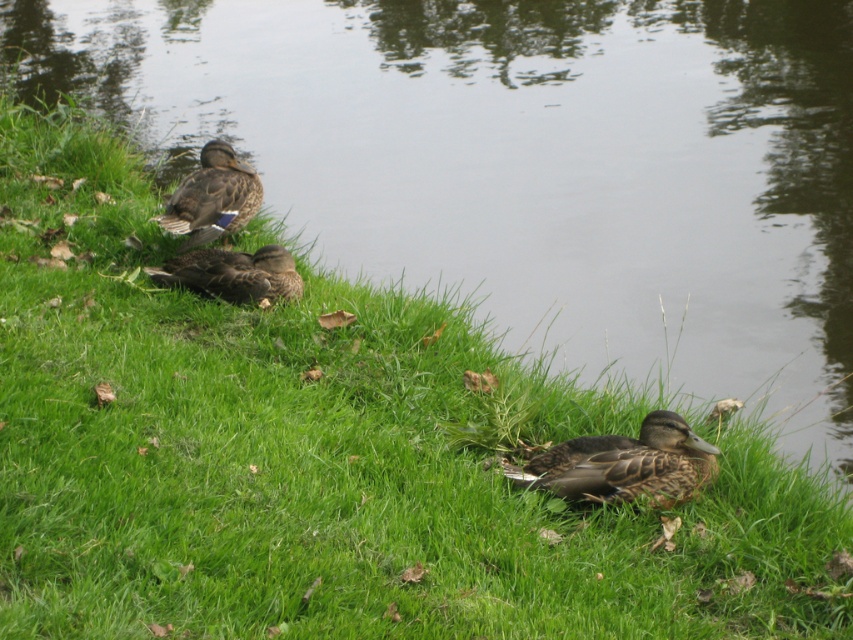
Question: Which object is closer to the camera taking this photo?

Choices:
 (A) brown feathered duck at upper left
 (B) brown speckled duck at center

Answer: (B)

Question: Can you confirm if brown feathered duck at upper left is smaller than brown matte duck at center?

Choices:
 (A) yes
 (B) no

Answer: (B)

Question: Which object appears closest to the camera in this image?

Choices:
 (A) brown matte duck at center
 (B) brown speckled duck at center
 (C) brown feathered duck at upper left

Answer: (B)

Question: Is brown feathered duck at upper left wider than brown matte duck at center?

Choices:
 (A) yes
 (B) no

Answer: (B)

Question: Does brown speckled duck at center appear on the right side of brown matte duck at center?

Choices:
 (A) no
 (B) yes

Answer: (B)

Question: Among these points, which one is nearest to the camera?

Choices:
 (A) (209, 192)
 (B) (682, 497)
 (C) (280, 250)

Answer: (B)